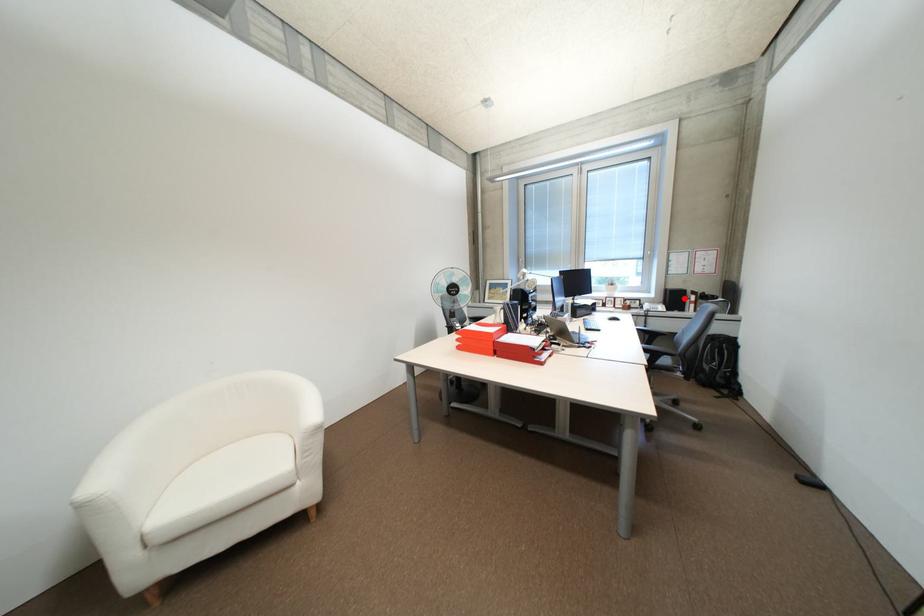
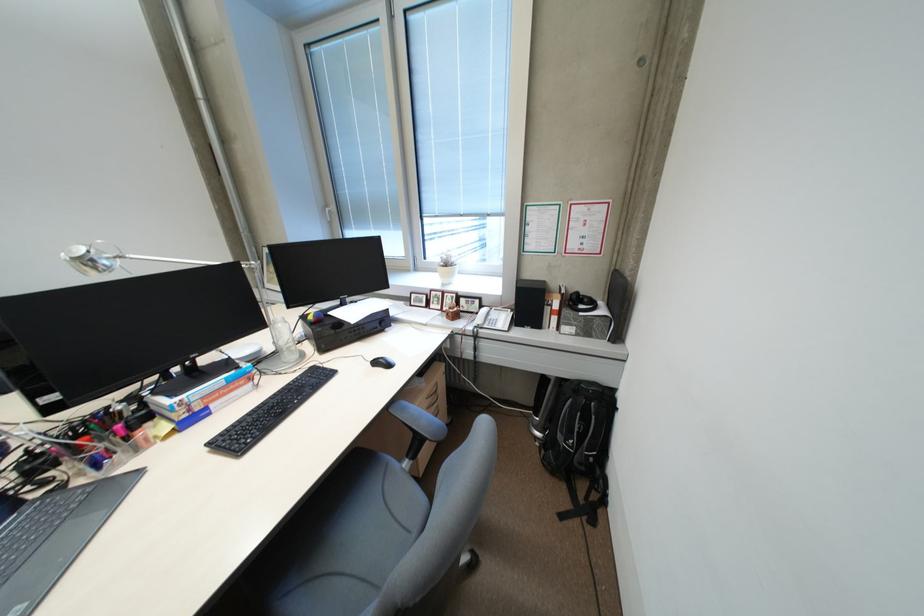
Where in the second image is the point corresponding to the highlighted location from the first image?

(538, 302)